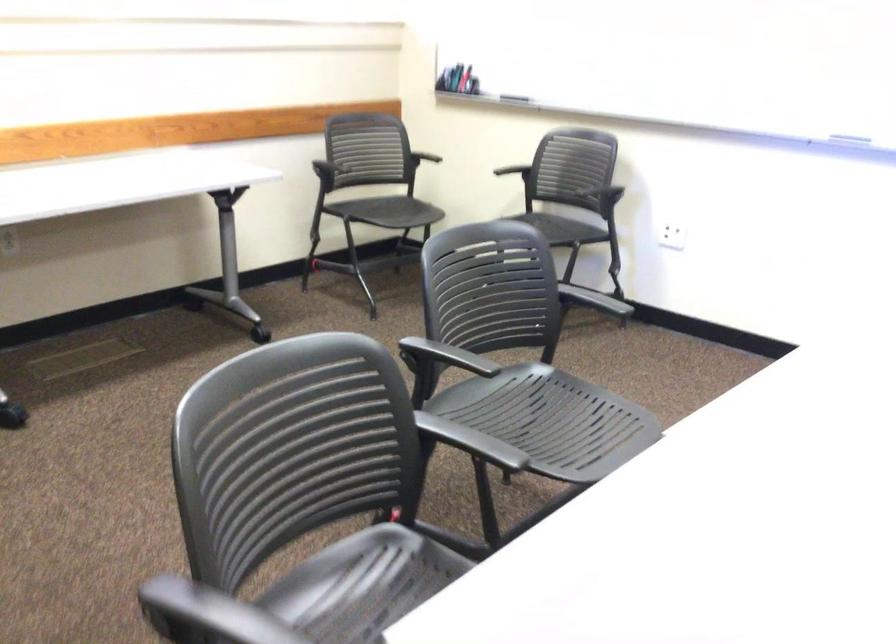
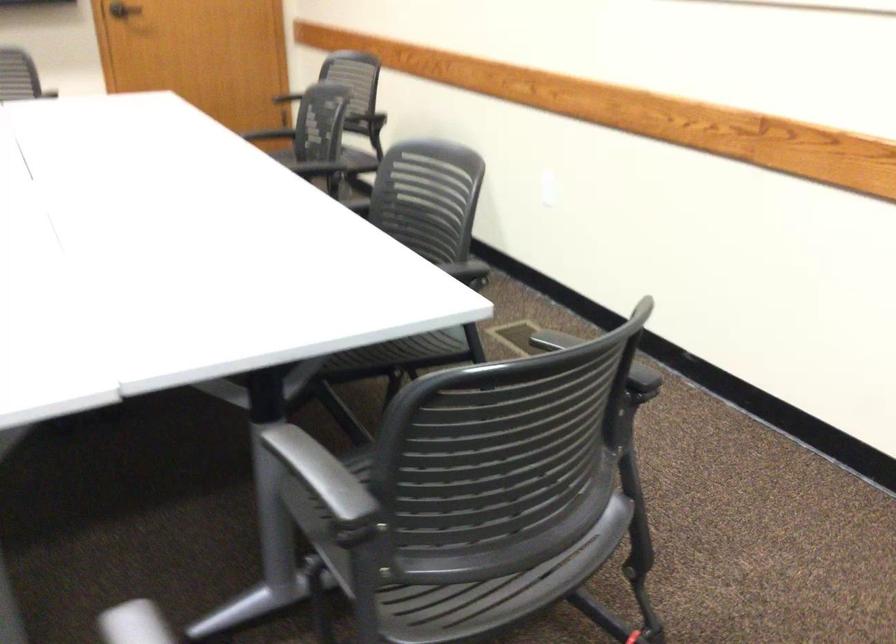
Locate, in the second image, the point that corresponds to the point at 462,448 in the first image.

(321, 473)